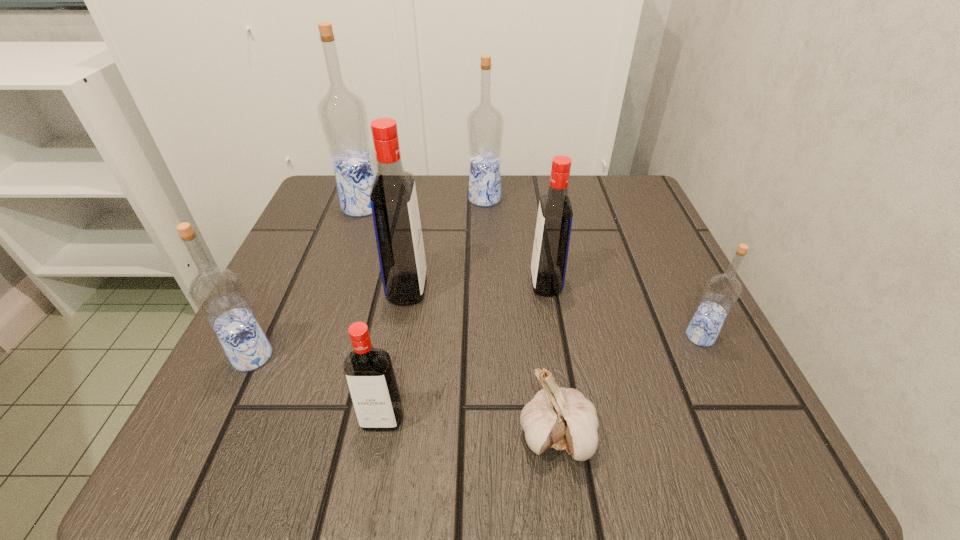
I want to click on the second vodka from left to right, so click(x=342, y=114).

You are a GUI agent. You are given a task and a screenshot of the screen. Output one action in this format:
    pyautogui.click(x=<x>, y=<y>)
    Task: Click on the third blue vodka from right to left
    The height and width of the screenshot is (540, 960).
    Given the screenshot: What is the action you would take?
    pyautogui.click(x=342, y=114)

I want to click on the fifth object from left to right, so click(485, 124).

Where is `the third vodka from right to left`? the third vodka from right to left is located at coordinates (485, 124).

The image size is (960, 540). I want to click on the biggest red vodka, so click(x=393, y=198).

What are the coordinates of `the second smallest red vodka` in the screenshot? It's located at (553, 228).

Identify the location of the rightmost red vodka. The width and height of the screenshot is (960, 540). (553, 228).

Where is `the leftmost vodka`? The image size is (960, 540). the leftmost vodka is located at coordinates (218, 293).

Where is `the leftmost blue vodka`? the leftmost blue vodka is located at coordinates (218, 293).

Identify the location of the nearest vodka. (369, 373).